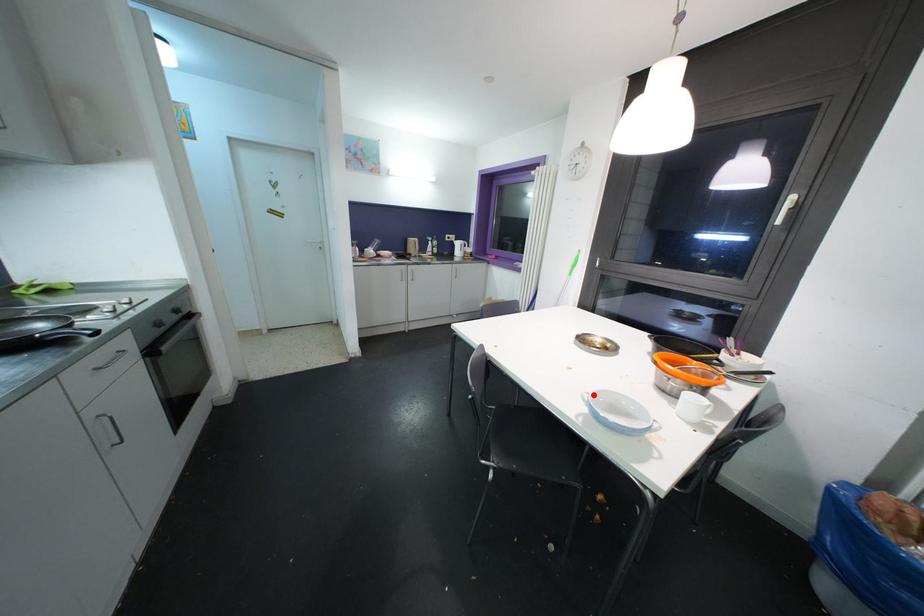
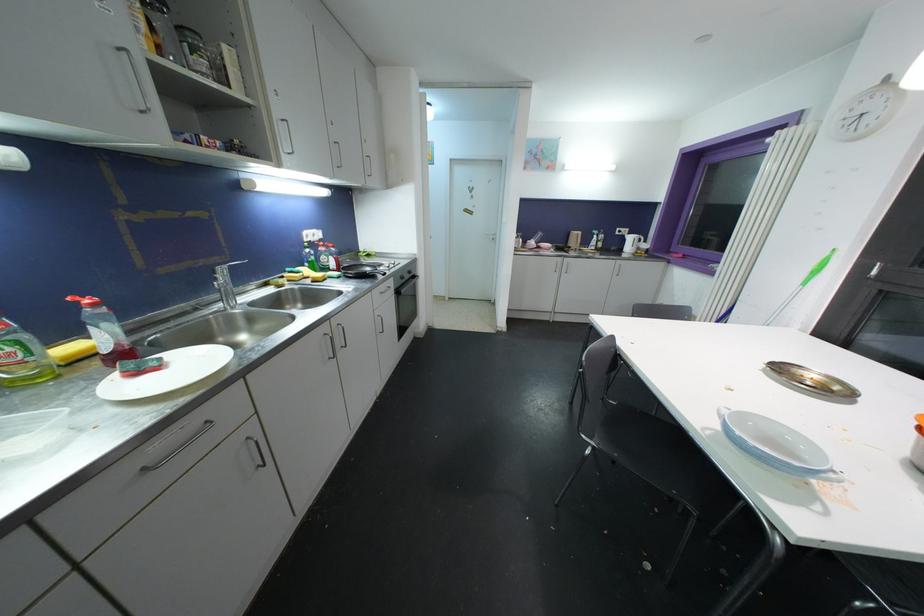
Where in the second image is the point corresponding to the highlighted location from the first image?

(737, 411)